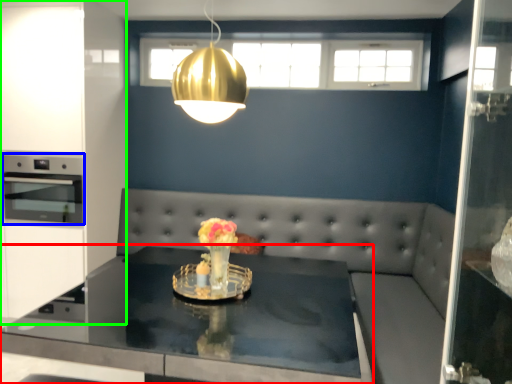
Question: Which object is positioned farthest from table (highlighted by a red box)? Select from appliance (highlighted by a blue box) and cabinetry (highlighted by a green box).

Choices:
 (A) appliance
 (B) cabinetry

Answer: (B)